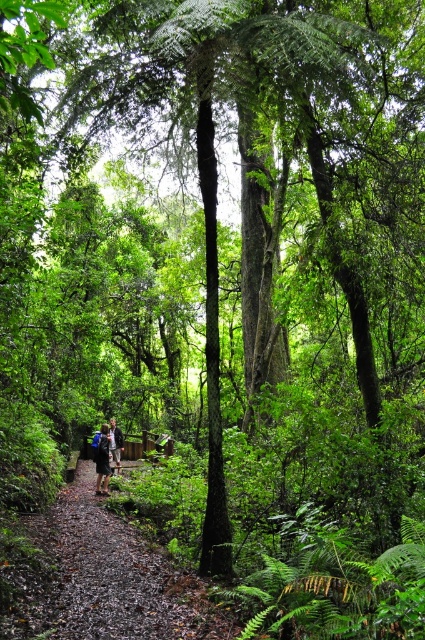
You are a hiker carrying a blue fabric backpack at center and need to walk along the brown dirt path at center. Can you fit the backpack on the path without stepping off the path?

The brown dirt path at center has a larger size compared to the blue fabric backpack at center, so yes, the backpack can fit on the path without the hiker needing to step off.

You are a hiker who just arrived at the forest path. You notice a blue fabric backpack at center and a dark blue jacket at center. Which item is positioned to the right side?

The blue fabric backpack at center is positioned to the right of the dark blue jacket at center.

You are a hiker navigating a forest path and want to determine the distance between two points marked on your map. The points are labeled as point 1 at coordinates point (107, 433) and point 2 at coordinates point (115, 422). Based on the image, which point is closer to you?

Point (107, 433) is closer to the camera than point (115, 422), so point 1 is closer to you.